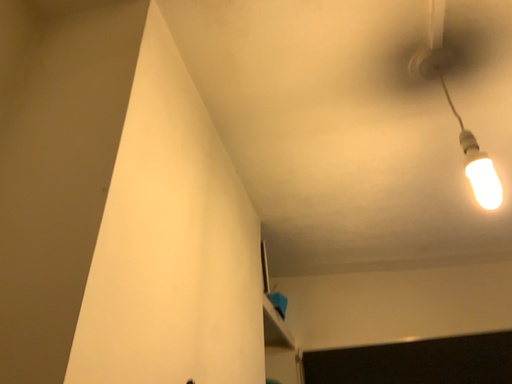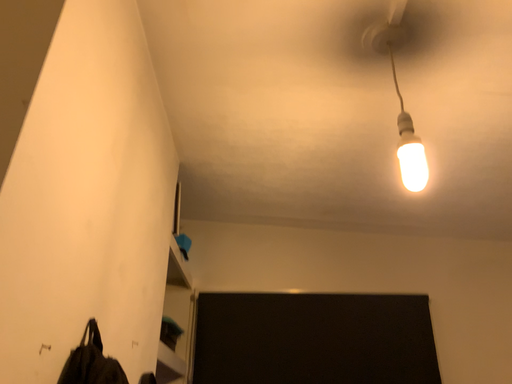
Question: Which way did the camera rotate in the video?

Choices:
 (A) rotated upward
 (B) rotated downward

Answer: (B)